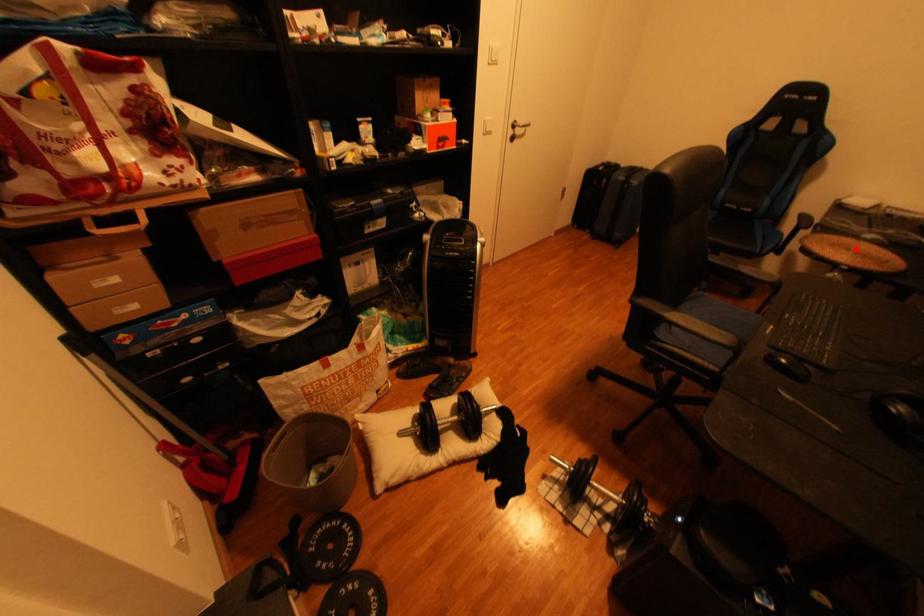
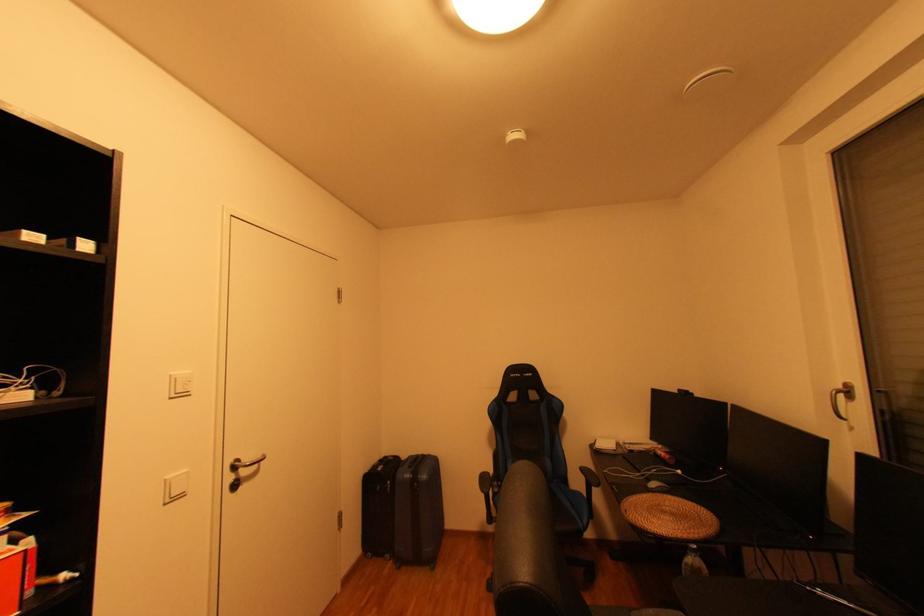
The point at the highlighted location is marked in the first image. Where is the corresponding point in the second image?

(674, 513)